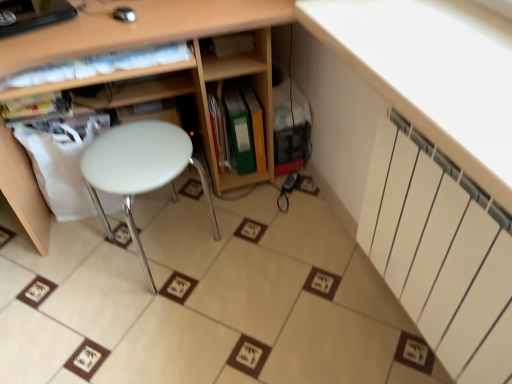
Find the location of a particular element. free area in between white plastic stool at center and wooden at center is located at coordinates (182, 269).